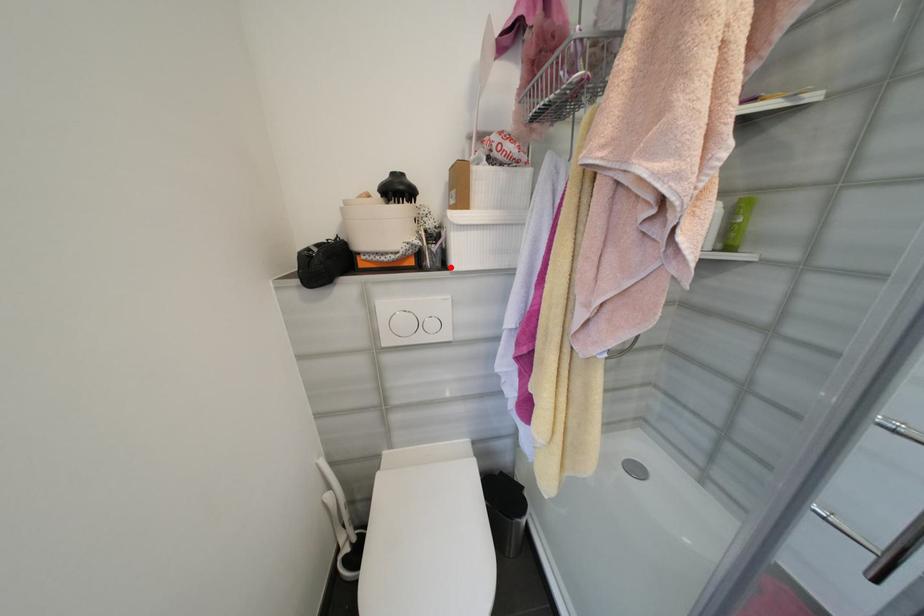
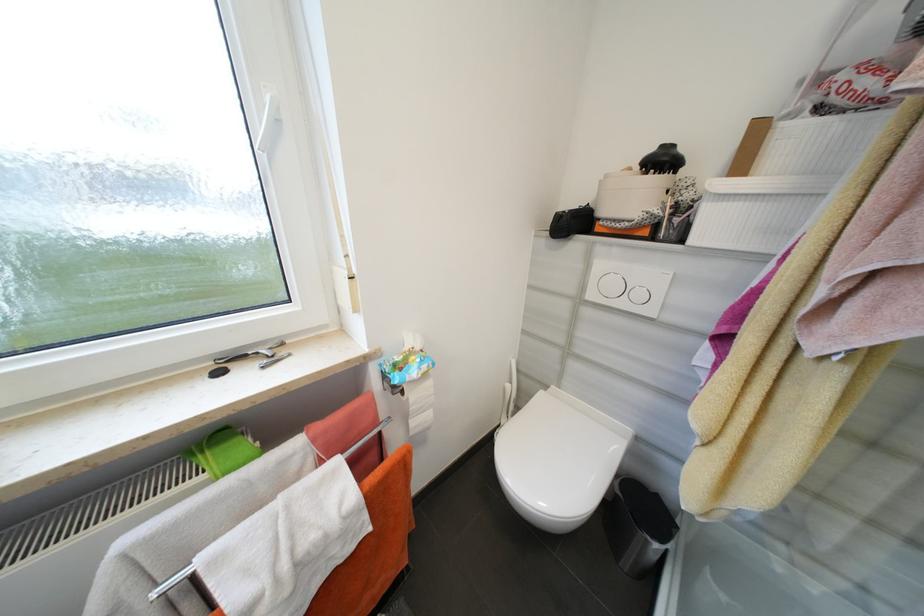
In the second image, find the point that corresponds to the highlighted location in the first image.

(687, 241)